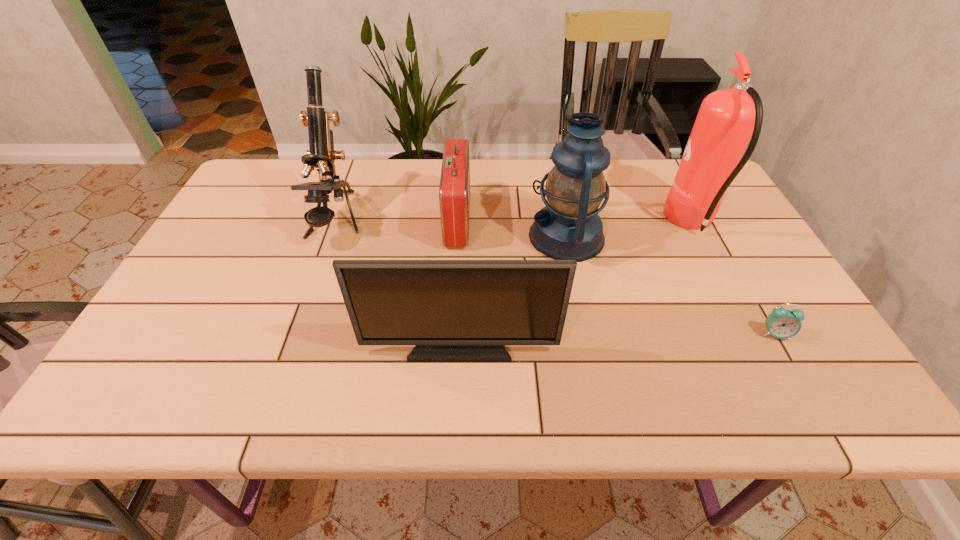
Identify the location of fire extinguisher. (727, 119).

This screenshot has width=960, height=540. What are the coordinates of `the leftmost object` in the screenshot? It's located at (322, 155).

At what (x,y) coordinates should I click in order to perform the action: click on lantern. Please return your answer as a coordinate pair (x, y). Looking at the image, I should click on (568, 228).

Where is `the third shortest object`? The height and width of the screenshot is (540, 960). the third shortest object is located at coordinates (453, 310).

Locate an element on the screen. Image resolution: width=960 pixels, height=540 pixels. the first-aid kit is located at coordinates (454, 191).

Where is `alarm clock`? alarm clock is located at coordinates (781, 323).

This screenshot has height=540, width=960. In order to click on vacant space located 0.150m towards the nozzle of the fire extinguisher in this screenshot , I will do `click(614, 223)`.

The height and width of the screenshot is (540, 960). I want to click on free space located towards the nozzle of the fire extinguisher, so (578, 223).

Locate an element on the screen. vacant space located 0.340m towards the nozzle of the fire extinguisher is located at coordinates (546, 223).

Locate an element on the screen. The width and height of the screenshot is (960, 540). free location located through the eyepiece of the leftmost object is located at coordinates (280, 380).